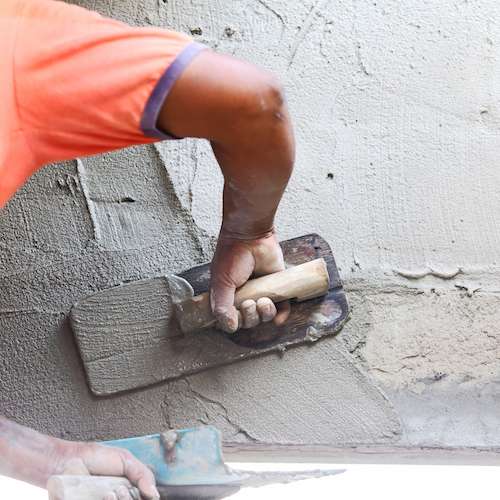
The image size is (500, 500). I want to click on old cement on wall, so click(365, 47), click(25, 289).